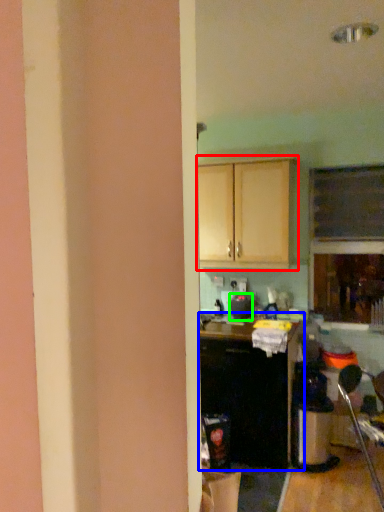
Question: Which is nearer to the cabinetry (highlighted by a red box)? cabinetry (highlighted by a blue box) or appliance (highlighted by a green box).

Choices:
 (A) cabinetry
 (B) appliance

Answer: (B)